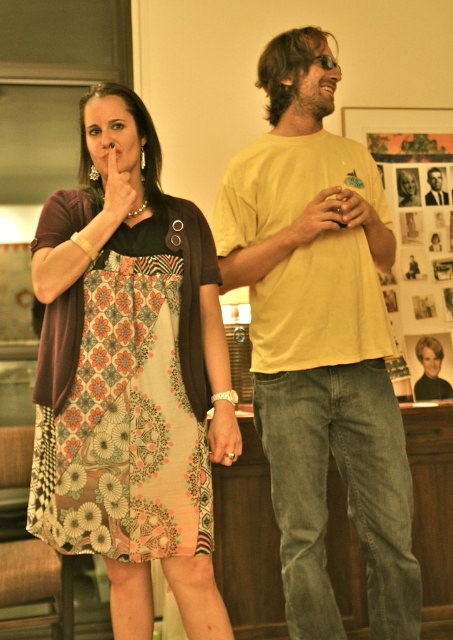
Question: Which point is farther from the camera taking this photo?

Choices:
 (A) (123, 460)
 (B) (299, 60)

Answer: (B)

Question: Based on their relative distances, which object is nearer to the yellow cotton t-shirt at center?

Choices:
 (A) smooth beige shirt at upper right
 (B) floral-patterned fabric dress at center

Answer: (B)

Question: Does floral-patterned fabric dress at center have a larger size compared to smooth beige shirt at upper right?

Choices:
 (A) yes
 (B) no

Answer: (A)

Question: Estimate the real-world distances between objects in this image. Which object is farther from the yellow cotton t-shirt at center?

Choices:
 (A) floral-patterned fabric dress at center
 (B) smooth beige shirt at upper right

Answer: (B)

Question: Can you confirm if yellow cotton t-shirt at center is positioned below smooth beige shirt at upper right?

Choices:
 (A) no
 (B) yes

Answer: (B)

Question: Is yellow cotton t-shirt at center positioned at the back of smooth beige shirt at upper right?

Choices:
 (A) no
 (B) yes

Answer: (A)